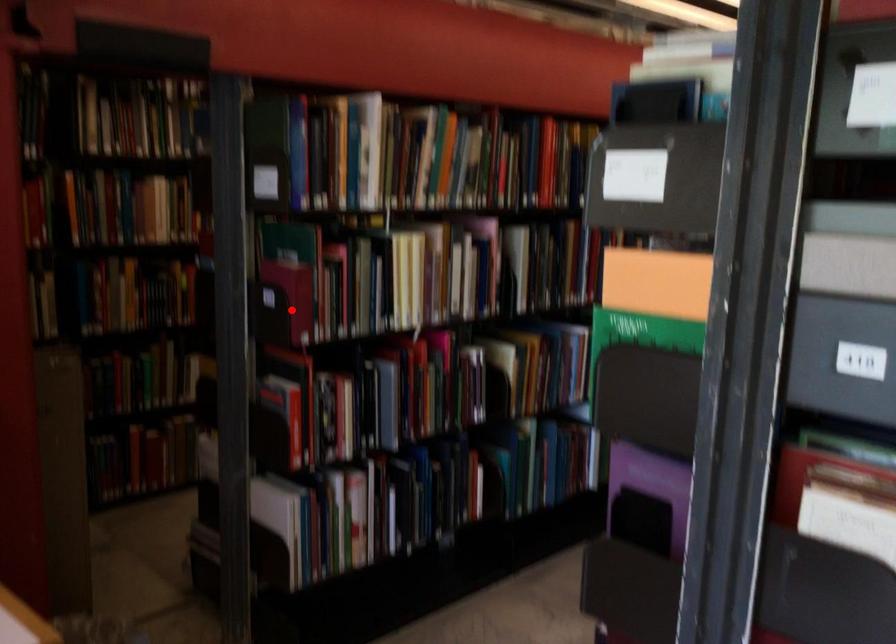
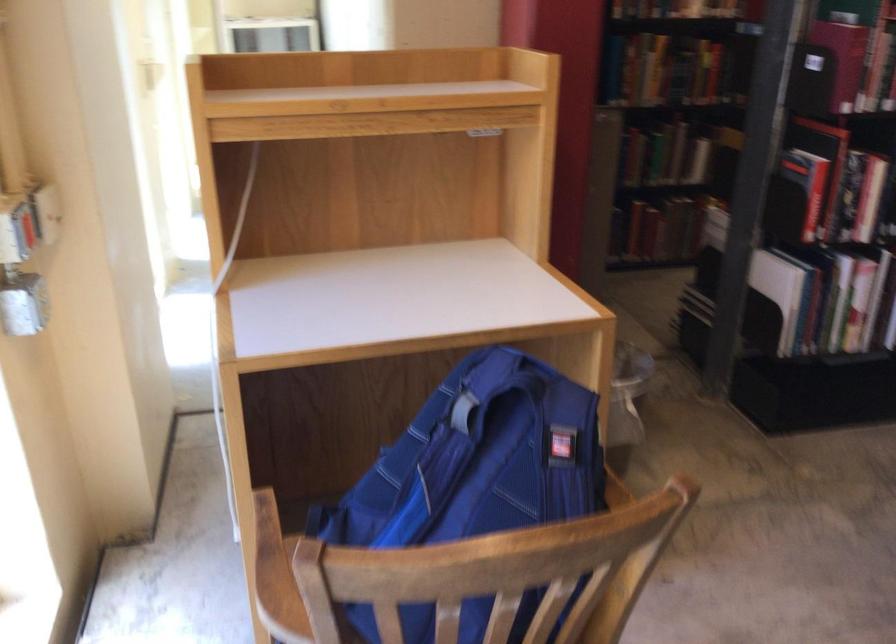
Locate, in the second image, the point that corresponds to the highlighted location in the first image.

(842, 59)